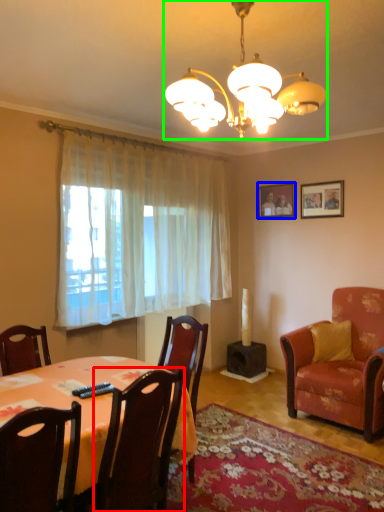
Question: Considering the real-world distances, which object is closest to chair (highlighted by a red box)? picture frame (highlighted by a blue box) or lamp (highlighted by a green box).

Choices:
 (A) picture frame
 (B) lamp

Answer: (B)